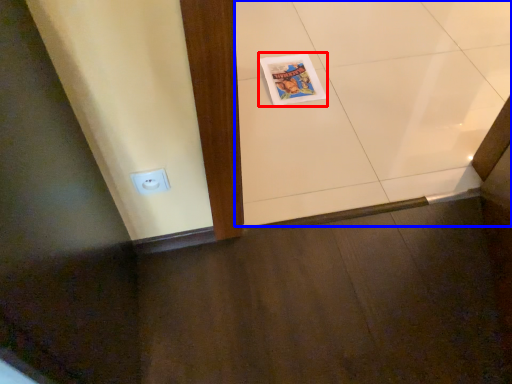
Question: Which of the following is the farthest to the observer, comic book (highlighted by a red box) or ceramic tile (highlighted by a blue box)?

Choices:
 (A) comic book
 (B) ceramic tile

Answer: (A)